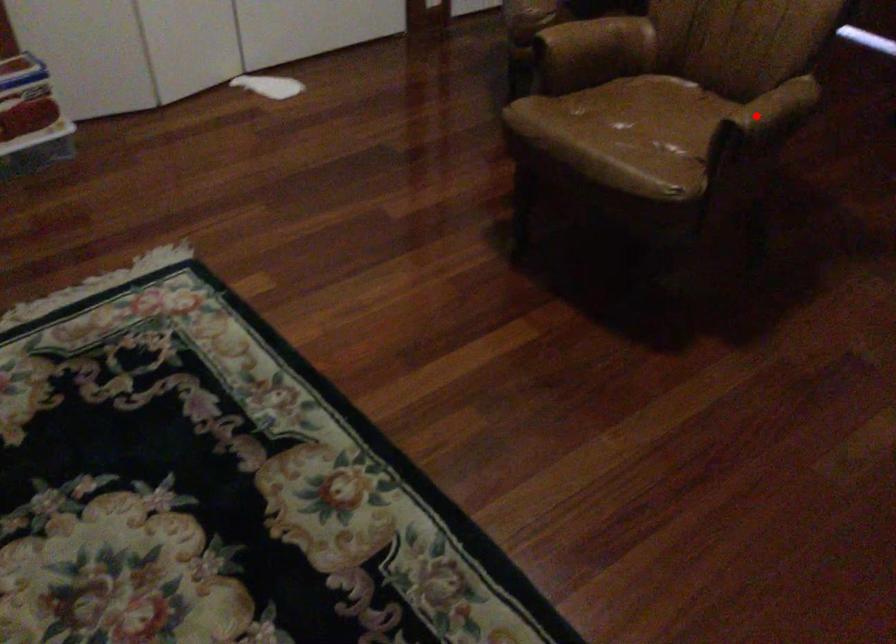
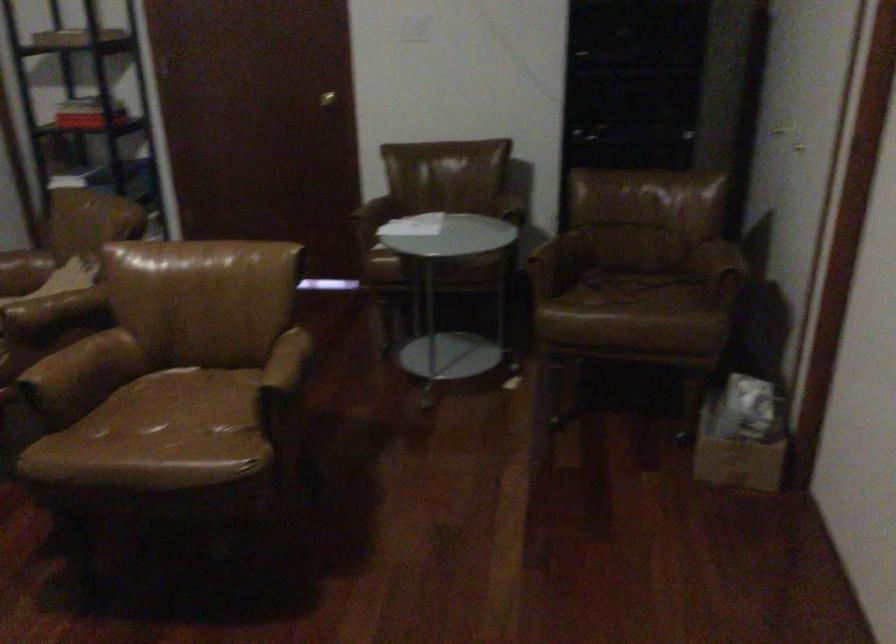
Question: A red point is marked in image1. In image2, is the corresponding 3D point closer to the camera or farther? Reply with the corresponding letter.

Choices:
 (A) The corresponding 3D point is closer.
 (B) The corresponding 3D point is farther.

Answer: (B)